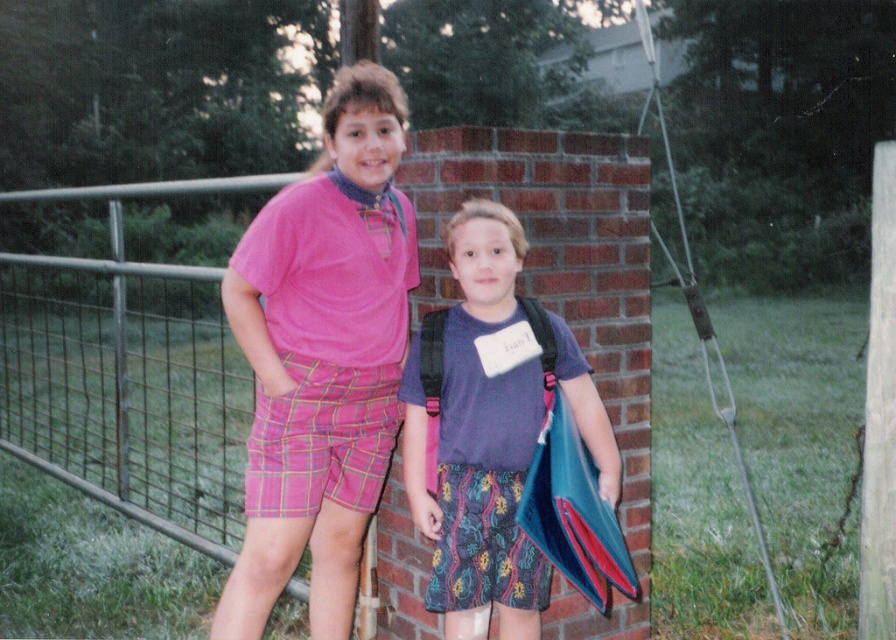
Is matte pink shirt at center positioned at the back of matte purple shirt at center?

No.

Who is positioned more to the left, matte pink shirt at center or matte purple shirt at center?

matte pink shirt at center

Measure the distance between matte pink shirt at center and camera.

The distance of matte pink shirt at center from camera is 2.29 meters.

Identify the location of matte pink shirt at center. The height and width of the screenshot is (640, 896). (322, 356).